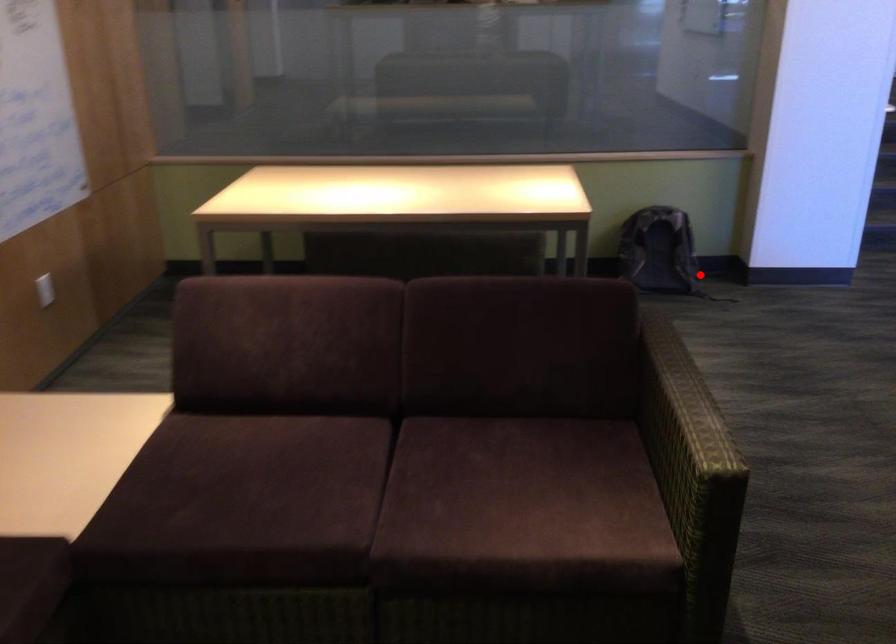
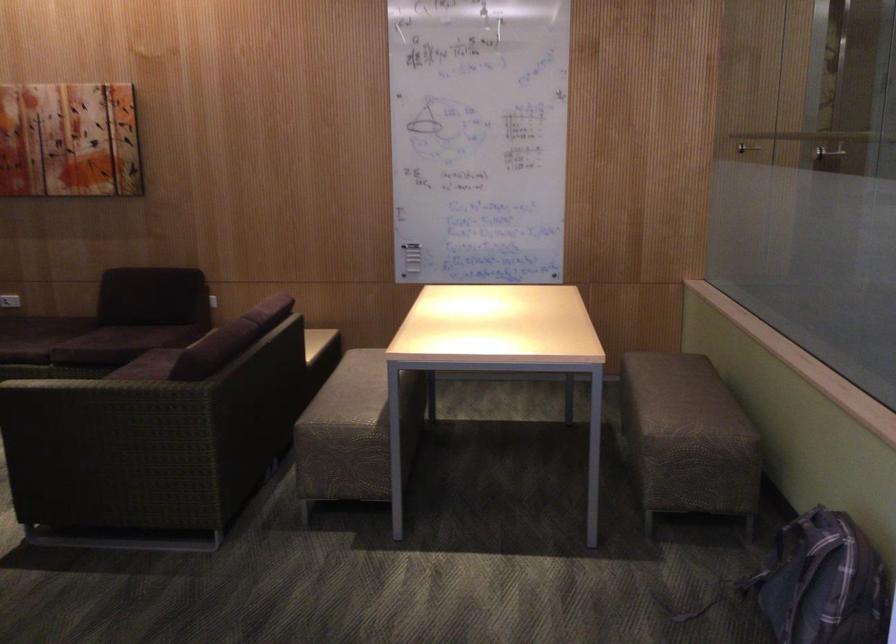
Question: A red point is marked in image1. In image2, is the corresponding 3D point closer to the camera or farther? Reply with the corresponding letter.

Choices:
 (A) The corresponding 3D point is closer.
 (B) The corresponding 3D point is farther.

Answer: (A)